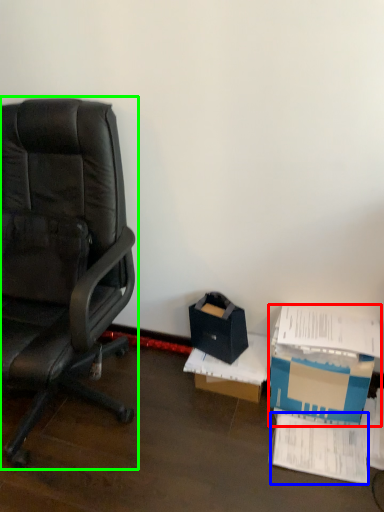
Question: Considering the real-world distances, which object is farthest from box (highlighted by a red box)? paperback book (highlighted by a blue box) or chair (highlighted by a green box)?

Choices:
 (A) paperback book
 (B) chair

Answer: (B)